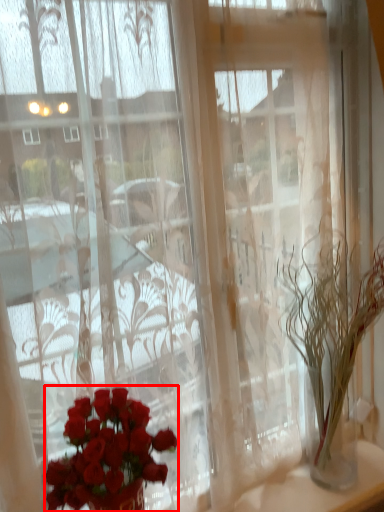
Question: From the image's perspective, where is flower (annotated by the red box) located in relation to houseplant in the image?

Choices:
 (A) below
 (B) above

Answer: (A)